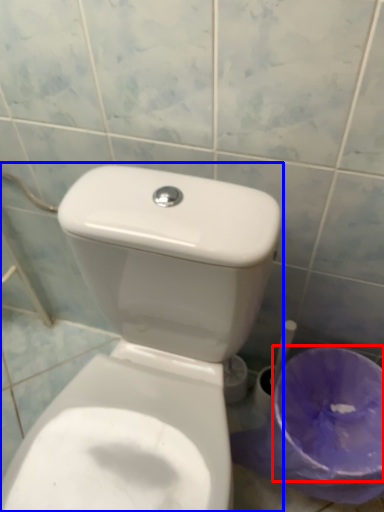
Question: Which object is closer to the camera taking this photo, potty (highlighted by a red box) or toilet (highlighted by a blue box)?

Choices:
 (A) potty
 (B) toilet

Answer: (B)